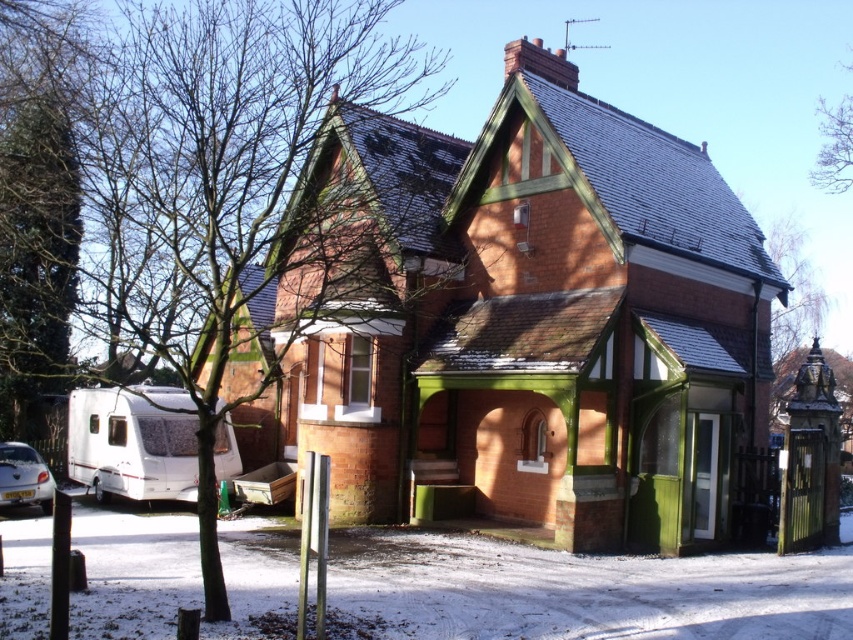
You are a delivery driver who needs to park your vehicle in the driveway of the house. You have two options to choose from, the white textured van at lower left and the metallic silver car at lower left. Which vehicle will require less space to park?

The white textured van at lower left has a smaller width than the metallic silver car at lower left, so it will require less space to park.

In the scene shown: You are standing in front of the house and want to park your car. You see a white textured van at lower left and a metallic silver car at lower left. Which vehicle is closer to the entranceway?

The metallic silver car at lower left is closer to the entranceway because the white textured van at lower left is located above it, meaning the van is positioned behind the car in the lower left area.